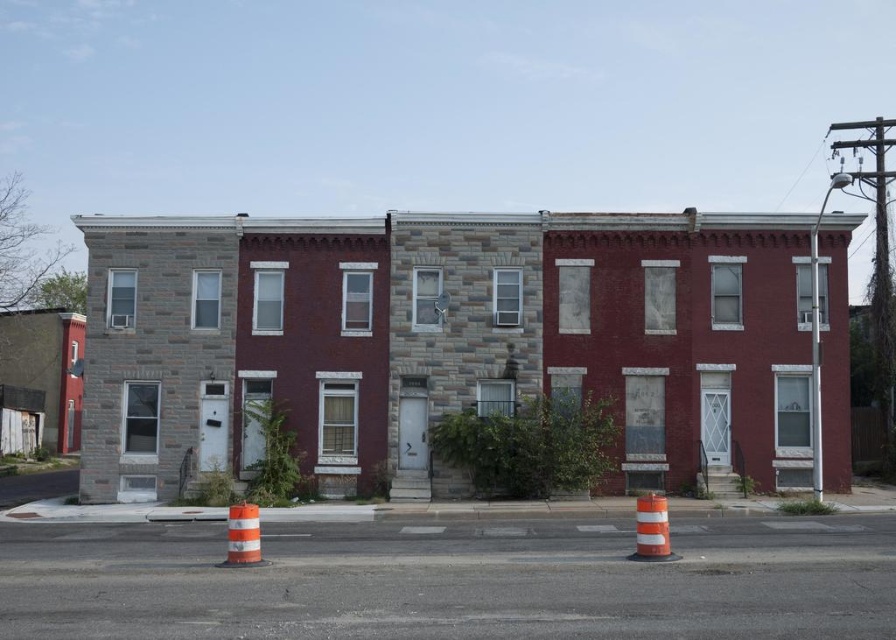
You are standing at the corner of the street looking towards the row of buildings. There is an orange striped traffic cone somewhere in the scene. Based on the coordinates provided, can you determine if the orange striped traffic cone at center is closer to the leftmost building or the rightmost building?

The orange striped traffic cone at center is located at coordinates point (651, 529). Since the buildings are aligned along the street, the cone is closer to the rightmost building.

You are standing on the street in front of the row of buildings. You see a point marked at coordinate (651, 529). Which object does this coordinate correspond to?

The point at coordinate (651, 529) corresponds to the orange striped traffic cone at center.